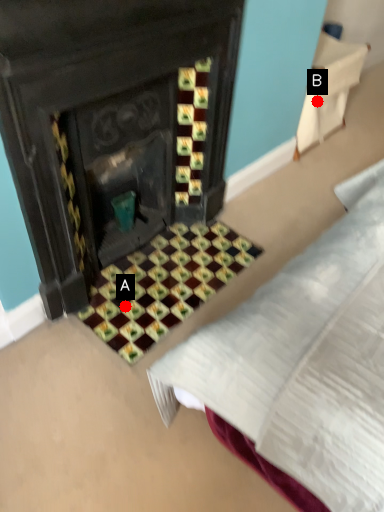
Question: Two points are circled on the image, labeled by A and B beside each circle. Which point is closer to the camera taking this photo?

Choices:
 (A) A is closer
 (B) B is closer

Answer: (A)